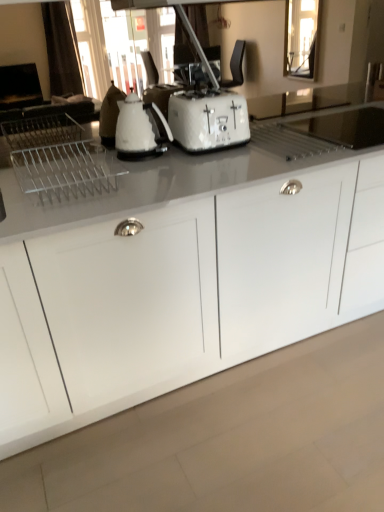
Where is `vacant area in front of white glossy kettle at center`? vacant area in front of white glossy kettle at center is located at coordinates (148, 168).